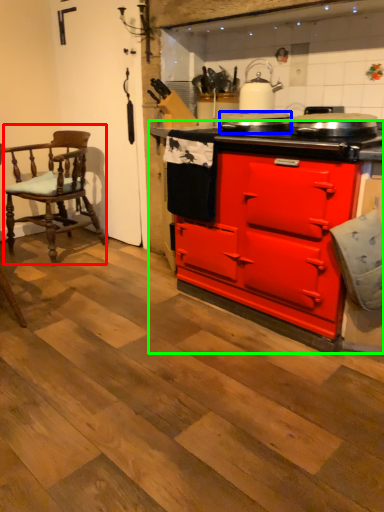
Question: Estimate the real-world distances between objects in this image. Which object is farther from chair (highlighted by a red box), appliance (highlighted by a blue box) or cabinetry (highlighted by a green box)?

Choices:
 (A) appliance
 (B) cabinetry

Answer: (A)